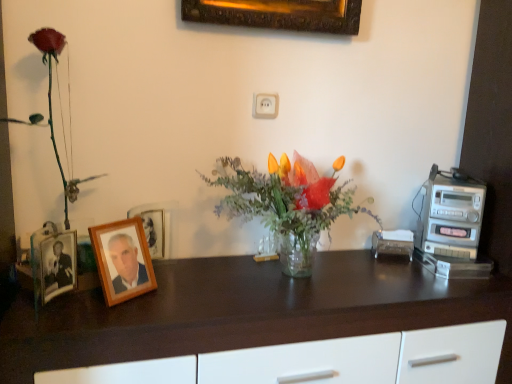
Locate an element on the screen. This screenshot has height=384, width=512. free space in front of wooden photo frame at left, the 2th picture frame when ordered from back to front is located at coordinates (98, 322).